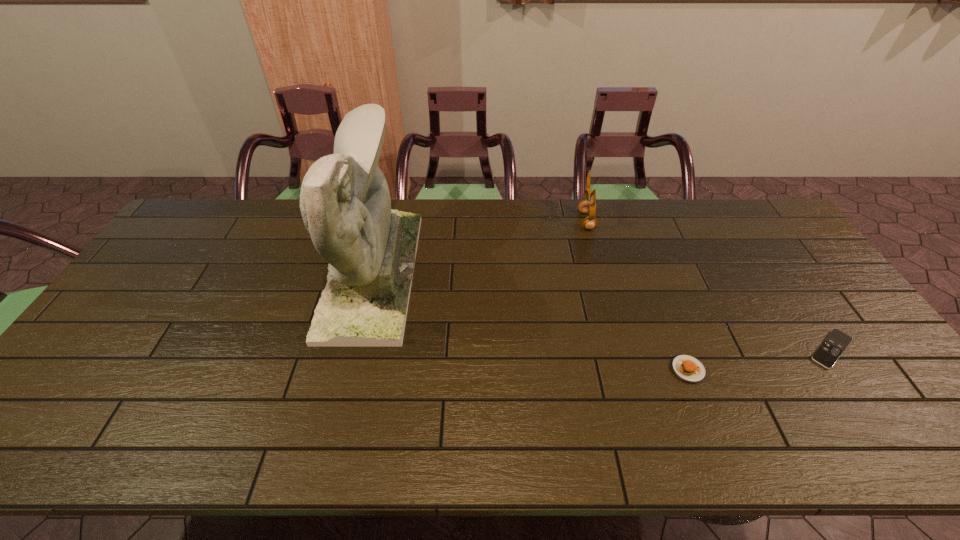
Locate an element on the screen. The height and width of the screenshot is (540, 960). vacant area between the food and the sculpture is located at coordinates click(x=530, y=321).

This screenshot has height=540, width=960. In order to click on empty space that is in between the second object from right to left and the earphone in this screenshot , I will do `click(636, 295)`.

At what (x,y) coordinates should I click in order to perform the action: click on free space between the second shortest object and the second object from left to right. Please return your answer as a coordinate pair (x, y). Image resolution: width=960 pixels, height=540 pixels. Looking at the image, I should click on (636, 295).

Locate an element on the screen. The width and height of the screenshot is (960, 540). the closest object to the second object from left to right is located at coordinates (688, 368).

Identify the location of object that can be found as the third closest to the second shortest object. The height and width of the screenshot is (540, 960). (345, 203).

Where is `free space in the image that satisfies the following two spatial constraints: 1. on the front-facing side of the rightmost object; 2. on the left side of the earphone`? The width and height of the screenshot is (960, 540). free space in the image that satisfies the following two spatial constraints: 1. on the front-facing side of the rightmost object; 2. on the left side of the earphone is located at coordinates (621, 349).

This screenshot has height=540, width=960. Identify the location of free space that satisfies the following two spatial constraints: 1. on the base of the rightmost object; 2. on the right side of the sculpture. (354, 349).

At what (x,y) coordinates should I click in order to perform the action: click on blank space that satisfies the following two spatial constraints: 1. on the base of the sculpture; 2. on the left side of the rightmost object. Please return your answer as a coordinate pair (x, y). Looking at the image, I should click on (354, 349).

Locate an element on the screen. vacant space that satisfies the following two spatial constraints: 1. on the base of the leftmost object; 2. on the right side of the second shortest object is located at coordinates (349, 369).

This screenshot has height=540, width=960. I want to click on vacant area that satisfies the following two spatial constraints: 1. on the base of the third tallest object; 2. on the right side of the tallest object, so click(349, 369).